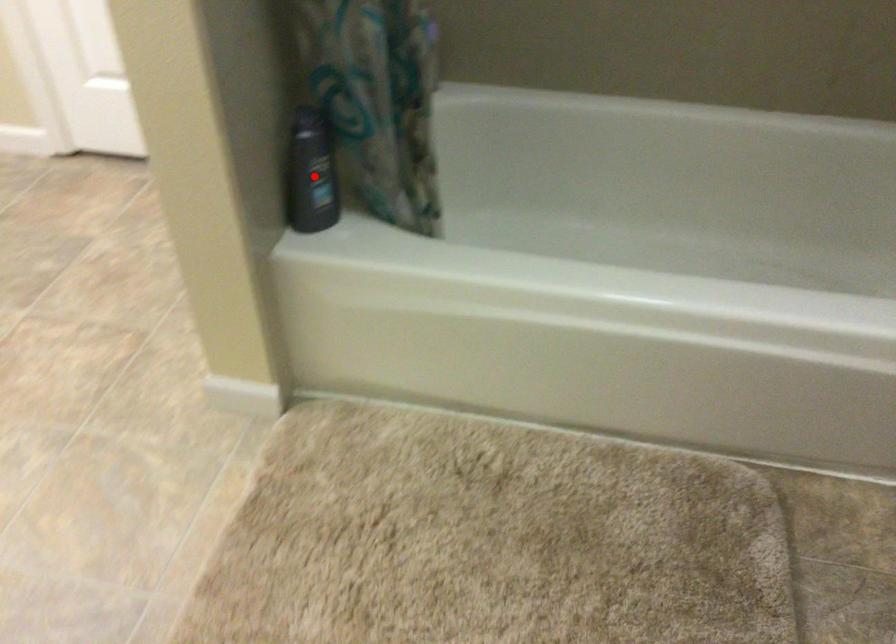
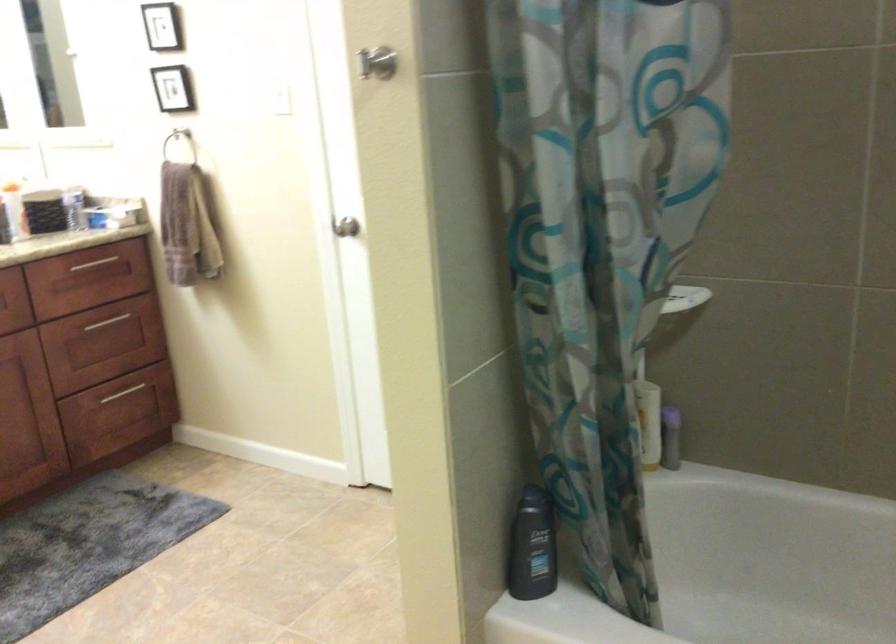
In the second image, find the point that corresponds to the highlighted location in the first image.

(531, 547)